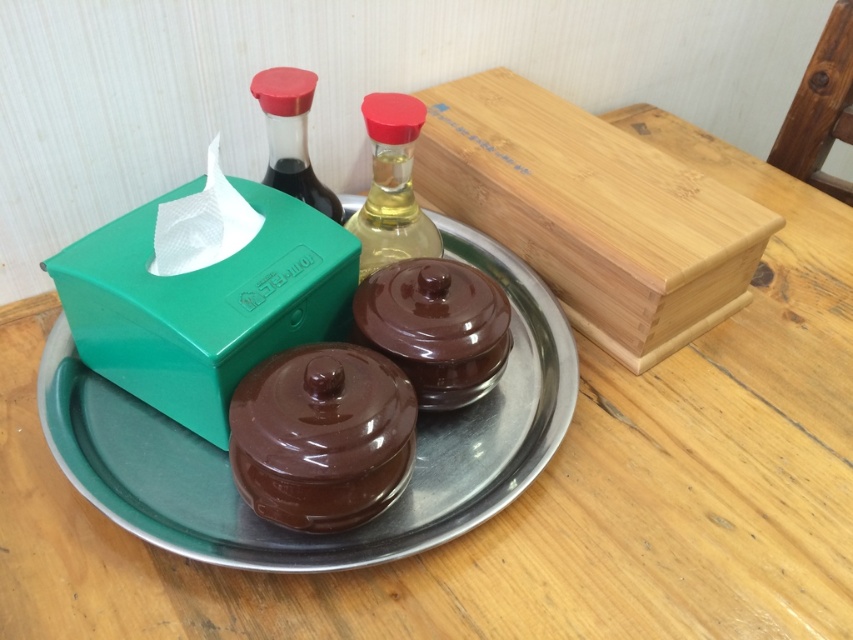
Does glossy brown chocolate cake at center have a greater width compared to shiny brown jar at center?

No, glossy brown chocolate cake at center is not wider than shiny brown jar at center.

Can you confirm if glossy brown chocolate cake at center is positioned to the left of shiny brown jar at center?

Yes, glossy brown chocolate cake at center is to the left of shiny brown jar at center.

Is point (320, 524) in front of point (405, 371)?

Yes, point (320, 524) is closer to viewer.

You are a GUI agent. You are given a task and a screenshot of the screen. Output one action in this format:
    pyautogui.click(x=<x>, y=<y>)
    Task: Click on the glossy brown chocolate cake at center
    
    Given the screenshot: What is the action you would take?
    pyautogui.click(x=322, y=435)

Is wooden box at upper right smaller than metallic silver plate at center?

Indeed, wooden box at upper right has a smaller size compared to metallic silver plate at center.

How much distance is there between wooden box at upper right and metallic silver plate at center?

wooden box at upper right is 6.94 inches away from metallic silver plate at center.

In order to click on wooden box at upper right in this screenshot , I will do `click(590, 212)`.

Who is positioned more to the right, shiny brown jar at center or translucent glass bottle at center?

From the viewer's perspective, shiny brown jar at center appears more on the right side.

Image resolution: width=853 pixels, height=640 pixels. I want to click on shiny brown jar at center, so click(x=436, y=326).

The width and height of the screenshot is (853, 640). What are the coordinates of `shiny brown jar at center` in the screenshot? It's located at (436, 326).